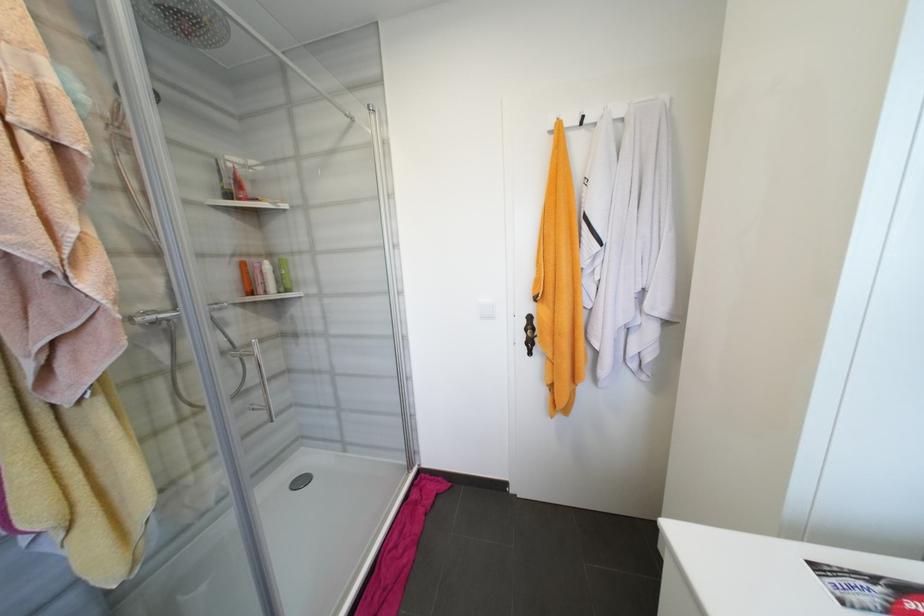
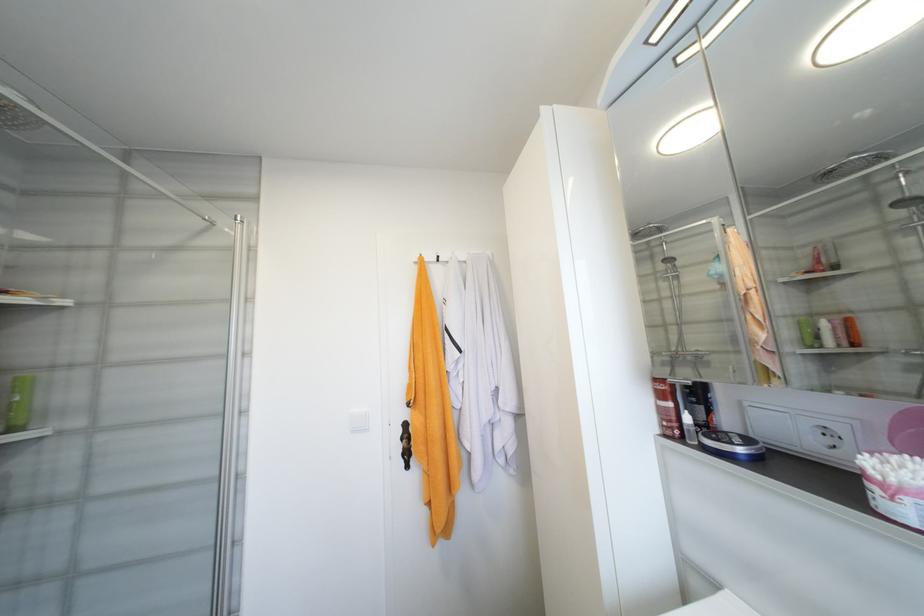
The point at (x=589, y=118) is marked in the first image. Where is the corresponding point in the second image?

(444, 257)